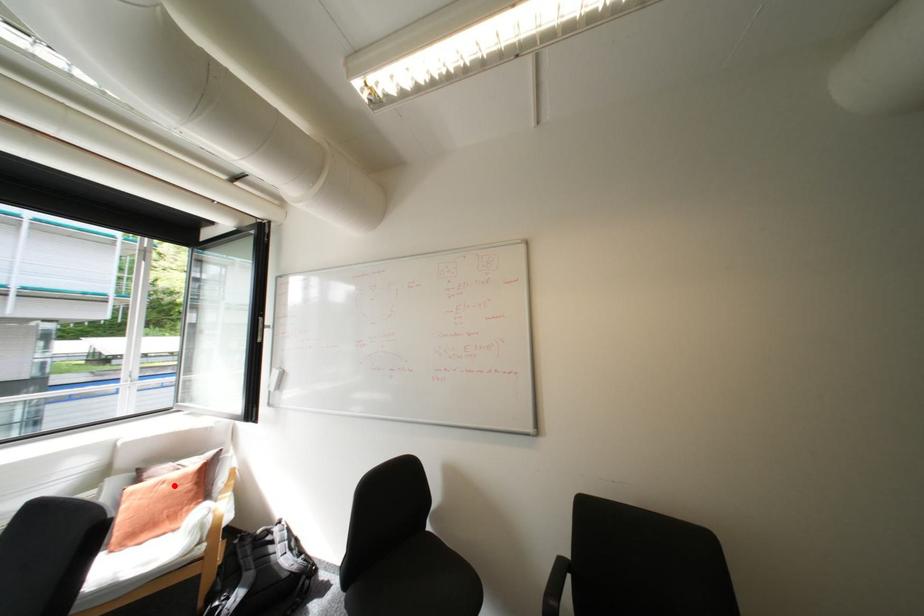
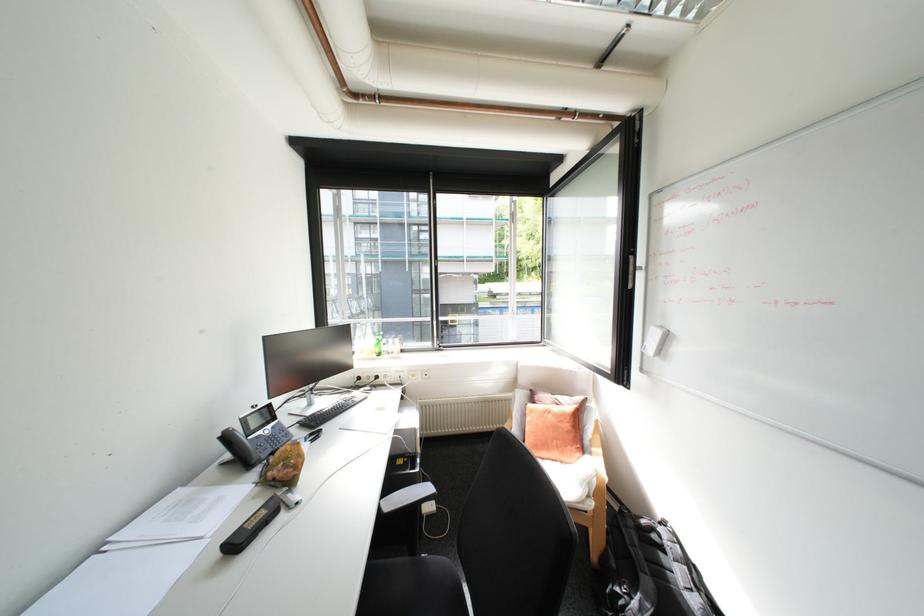
Question: I am providing you with two images of the same scene from different viewpoints. A red point is marked on the first image. Can you still see the location of the red point in image 2?

Choices:
 (A) Yes
 (B) No

Answer: (A)